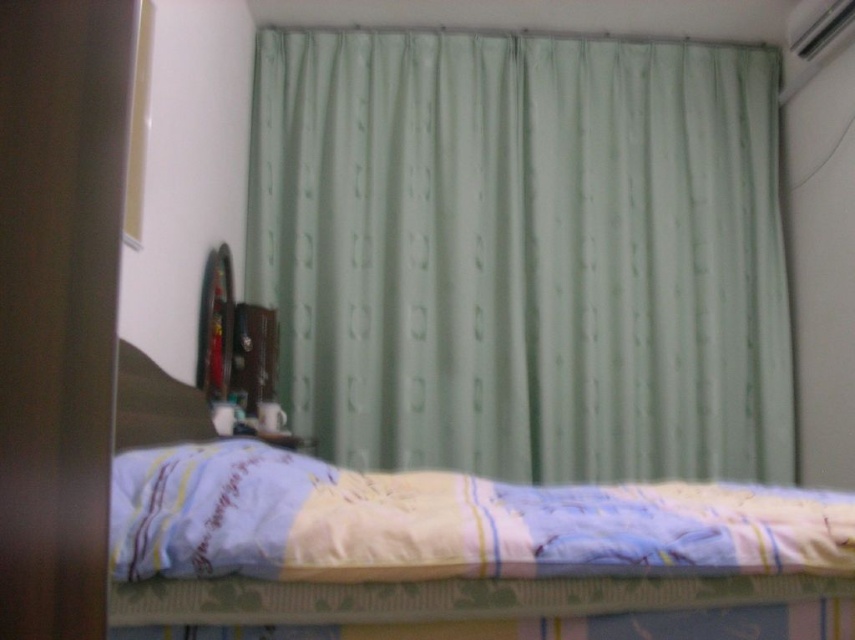
Question: Among these points, which one is nearest to the camera?

Choices:
 (A) (127, 387)
 (B) (305, 195)

Answer: (A)

Question: Considering the relative positions of light green fabric curtain at upper center and light blue quilted blanket at lower center in the image provided, where is light green fabric curtain at upper center located with respect to light blue quilted blanket at lower center?

Choices:
 (A) right
 (B) left

Answer: (A)

Question: Is light green fabric curtain at upper center closer to the viewer compared to yellow fabric bed at lower center?

Choices:
 (A) no
 (B) yes

Answer: (A)

Question: Which point is farther from the camera taking this photo?

Choices:
 (A) (139, 406)
 (B) (540, 211)
 (C) (635, 515)
 (D) (576, 548)

Answer: (B)

Question: Which object appears farthest from the camera in this image?

Choices:
 (A) brown fabric pillow at lower left
 (B) yellow fabric bed at lower center

Answer: (A)

Question: Is light blue quilted blanket at lower center positioned in front of brown fabric pillow at lower left?

Choices:
 (A) yes
 (B) no

Answer: (A)